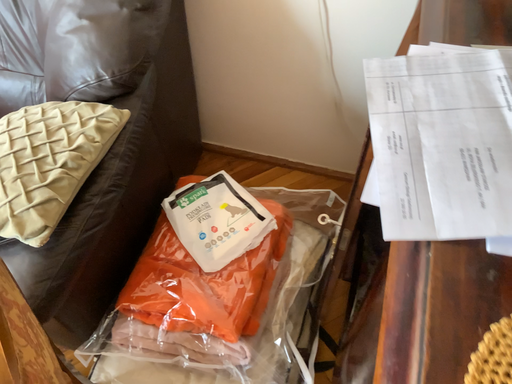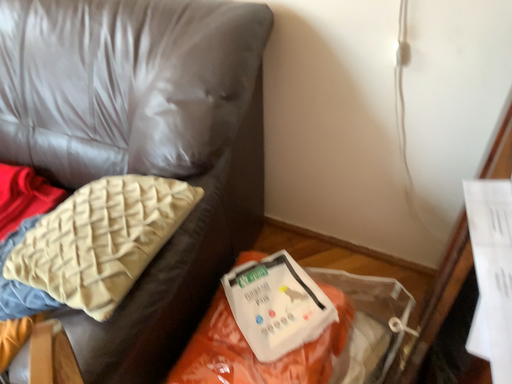
Question: Which way did the camera rotate in the video?

Choices:
 (A) rotated right
 (B) rotated left

Answer: (B)